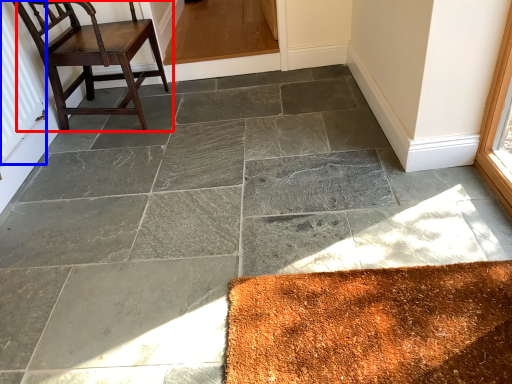
Question: Which point is closer to the camera, chair (highlighted by a red box) or radiator (highlighted by a blue box)?

Choices:
 (A) chair
 (B) radiator

Answer: (B)